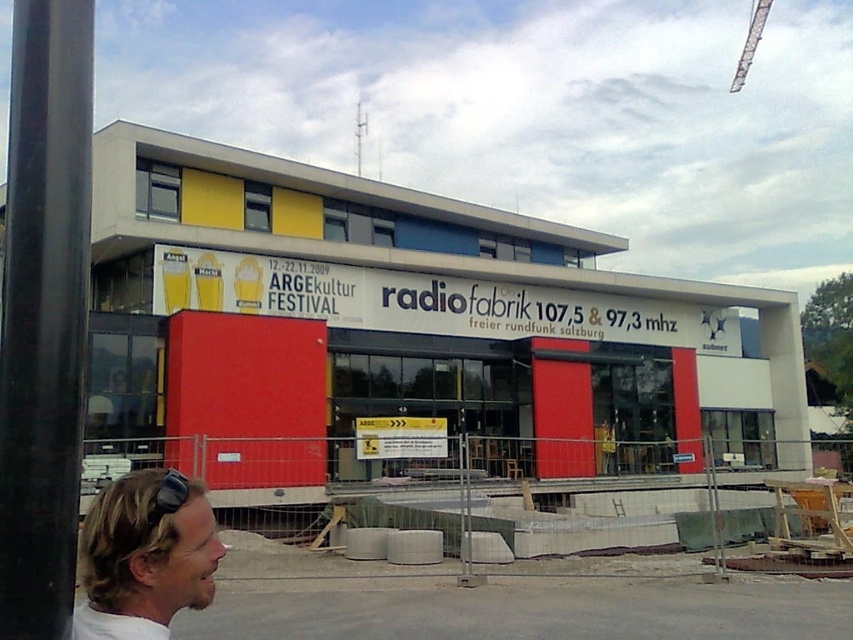
In the scene shown: You are a construction worker who needs to attach a safety harness to the thinnest metal structure in the scene. Which object should you choose between the black metal pole at left and the metallic silver crane at upper right?

The black metal pole at left is thinner than the metallic silver crane at upper right, so you should choose the black metal pole at left for attaching the safety harness.

You are a photographer trying to capture both the white matte shirt at lower left and the metallic silver crane at upper right in a single frame. Which object should you focus on first to ensure both are in the frame?

Since the metallic silver crane at upper right is wider than the white matte shirt at lower left, you should focus on the metallic silver crane at upper right first to ensure both fit within the frame.

You are standing in front of the modern building and see two points marked on the facade. One is at coordinate point [7,330] and the other at point [744,81]. Which point is closer to you?

Point [7,330] is in front of point [744,81], so it is closer to you.